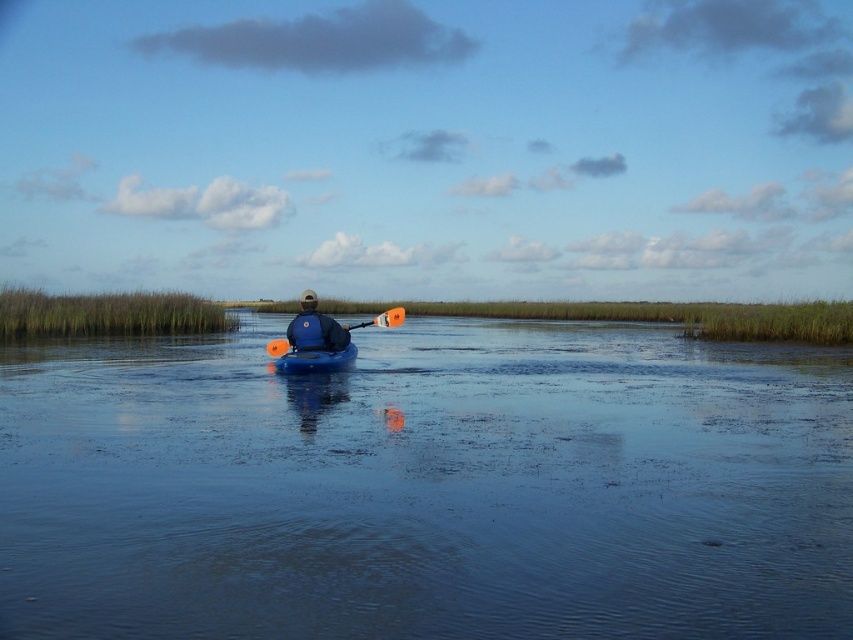
Can you confirm if blue plastic kayak at center is shorter than blue matte kayak at center?

No.

Is blue plastic kayak at center thinner than blue matte kayak at center?

No.

Who is more distant from viewer, (833, 477) or (294, 320)?

The point (294, 320) is more distant.

What are the coordinates of `blue plastic kayak at center` in the screenshot? It's located at (427, 486).

Who is positioned more to the left, blue plastic kayak at center or blue plastic canoe at center?

From the viewer's perspective, blue plastic canoe at center appears more on the left side.

Is blue plastic kayak at center wider than blue plastic canoe at center?

Yes.

What do you see at coordinates (427, 486) in the screenshot? This screenshot has height=640, width=853. I see `blue plastic kayak at center` at bounding box center [427, 486].

Where is `blue plastic kayak at center`? blue plastic kayak at center is located at coordinates (427, 486).

Does blue plastic canoe at center appear on the right side of orange paddle at center?

Incorrect, blue plastic canoe at center is not on the right side of orange paddle at center.

Measure the distance between point (x=310, y=349) and camera.

Point (x=310, y=349) is 61.09 feet away from camera.

At what (x,y) coordinates should I click in order to perform the action: click on blue plastic canoe at center. Please return your answer as a coordinate pair (x, y). Looking at the image, I should click on (314, 360).

I want to click on blue plastic canoe at center, so (x=314, y=360).